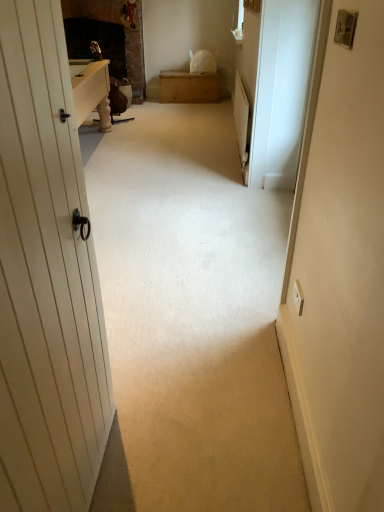
Question: Does wooden chest at center appear on the left side of white glossy screen door at right?

Choices:
 (A) no
 (B) yes

Answer: (B)

Question: Is wooden chest at center next to white glossy screen door at right?

Choices:
 (A) no
 (B) yes

Answer: (A)

Question: Does wooden chest at center have a lesser height compared to white glossy screen door at right?

Choices:
 (A) no
 (B) yes

Answer: (B)

Question: Could you tell me if wooden chest at center is facing white glossy screen door at right?

Choices:
 (A) no
 (B) yes

Answer: (B)

Question: From the image's perspective, is wooden chest at center located beneath white glossy screen door at right?

Choices:
 (A) no
 (B) yes

Answer: (A)

Question: Is white glossy screen door at right located within wooden chest at center?

Choices:
 (A) yes
 (B) no

Answer: (B)

Question: From a real-world perspective, is wooden chest at center below metallic silver lock at upper right?

Choices:
 (A) yes
 (B) no

Answer: (A)

Question: Does wooden chest at center appear on the left side of metallic silver lock at upper right?

Choices:
 (A) yes
 (B) no

Answer: (A)

Question: From the image's perspective, would you say wooden chest at center is shown under metallic silver lock at upper right?

Choices:
 (A) yes
 (B) no

Answer: (B)

Question: Is wooden chest at center with metallic silver lock at upper right?

Choices:
 (A) no
 (B) yes

Answer: (A)

Question: Is the position of wooden chest at center more distant than that of metallic silver lock at upper right?

Choices:
 (A) yes
 (B) no

Answer: (A)

Question: From a real-world perspective, is wooden chest at center located higher than metallic silver lock at upper right?

Choices:
 (A) no
 (B) yes

Answer: (A)

Question: Considering the relative sizes of metallic silver lock at upper right and wooden chest at center in the image provided, is metallic silver lock at upper right thinner than wooden chest at center?

Choices:
 (A) no
 (B) yes

Answer: (B)